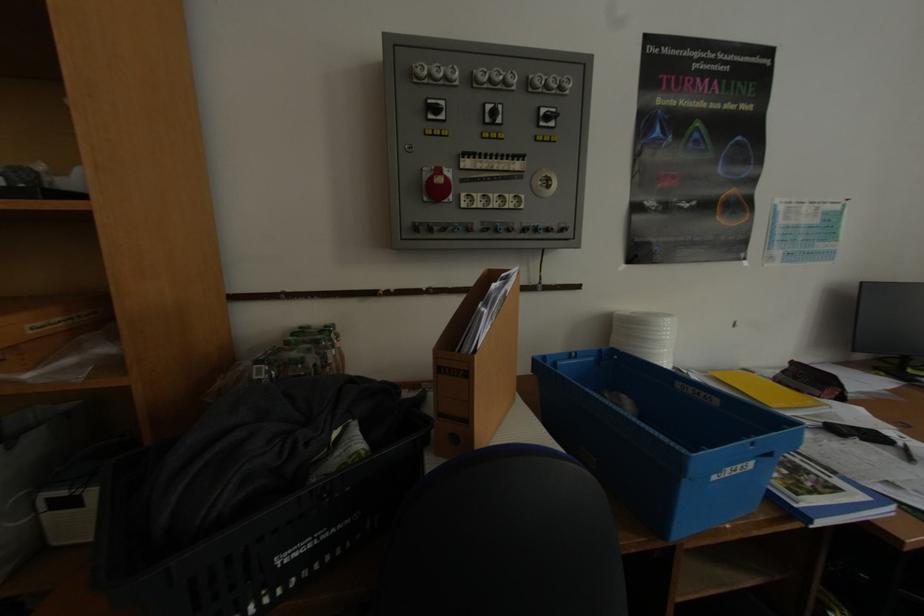
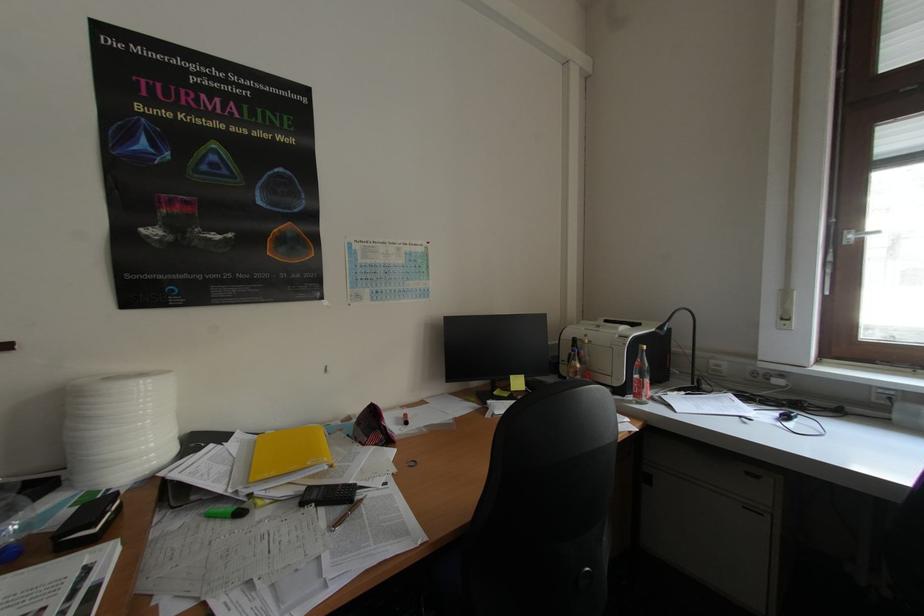
Question: Which direction would the cameraman need to move to produce the second image? Reply with the corresponding letter.

Choices:
 (A) Left
 (B) Right
 (C) Forward
 (D) Backward

Answer: (B)